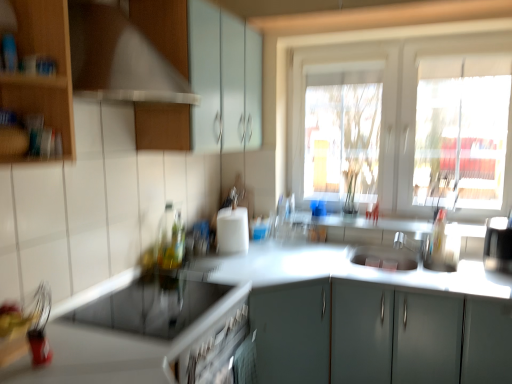
Locate an element on the screen. blank space situated above white glossy countertop at lower left, acting as the first countertop starting from the top (from a real-world perspective) is located at coordinates (175, 300).